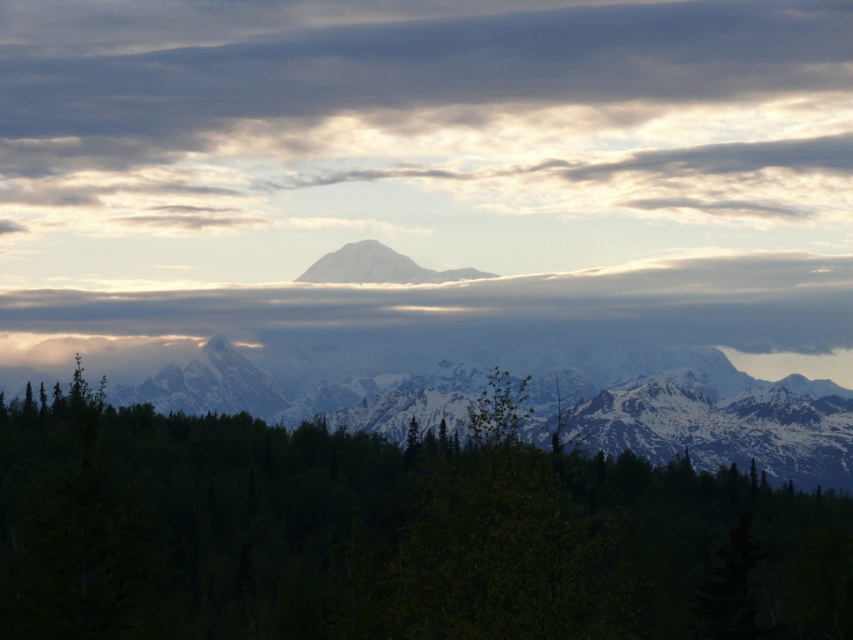
Question: Which object is farther from the camera taking this photo?

Choices:
 (A) snowy mountain range at center
 (B) cloudy sky at center
 (C) white snow-covered mountain at center
 (D) smokey gray cloud at center

Answer: (D)

Question: Estimate the real-world distances between objects in this image. Which object is closer to the white snow-covered mountain at center?

Choices:
 (A) snowy mountain range at center
 (B) smokey gray cloud at center
 (C) cloudy sky at center

Answer: (B)

Question: Based on their relative distances, which object is nearer to the white snow-covered mountain at center?

Choices:
 (A) cloudy sky at center
 (B) smokey gray cloud at center
 (C) snowy mountain range at center

Answer: (B)

Question: Does green leafy forest at center have a greater width compared to smokey gray cloud at center?

Choices:
 (A) yes
 (B) no

Answer: (A)

Question: Is cloudy sky at center further to camera compared to smokey gray cloud at center?

Choices:
 (A) no
 (B) yes

Answer: (A)

Question: Is cloudy sky at center behind snowy mountain range at center?

Choices:
 (A) no
 (B) yes

Answer: (B)